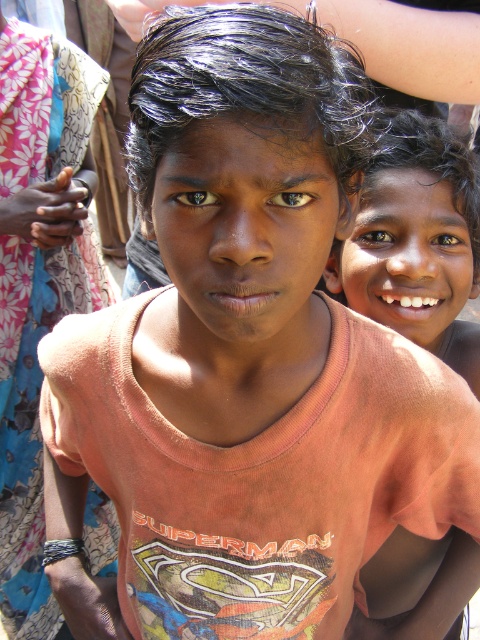
Question: Which of the following is the closest to the observer?

Choices:
 (A) (367, 314)
 (B) (39, 83)

Answer: (A)

Question: Is floral fabric sari at left thinner than matte orange t-shirt at center?

Choices:
 (A) no
 (B) yes

Answer: (A)

Question: Is floral fabric sari at left bigger than matte orange t-shirt at center?

Choices:
 (A) no
 (B) yes

Answer: (B)

Question: From the image, what is the correct spatial relationship of floral fabric sari at left in relation to matte orange t-shirt at center?

Choices:
 (A) below
 (B) above

Answer: (A)